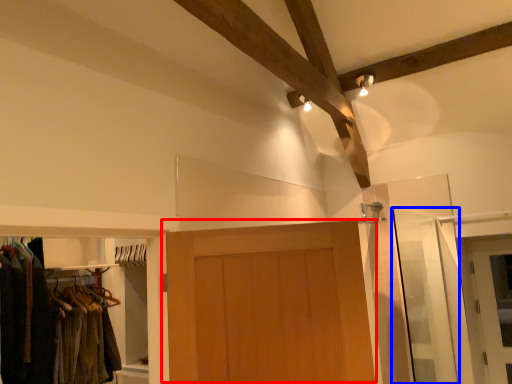
Question: Which object is further to the camera taking this photo, door (highlighted by a red box) or screen door (highlighted by a blue box)?

Choices:
 (A) door
 (B) screen door

Answer: (B)